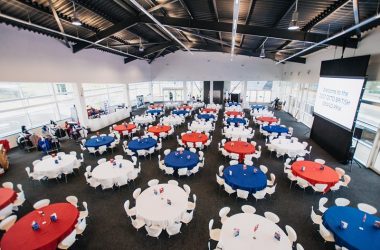
Locate an element on the screen. The height and width of the screenshot is (250, 380). windows is located at coordinates (40, 113), (102, 96), (144, 90), (169, 83), (258, 92), (310, 100), (367, 114).